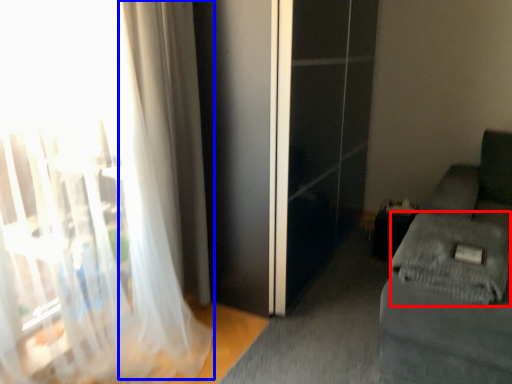
Question: Which of the following is the farthest to the observer, sheet (highlighted by a red box) or curtain (highlighted by a blue box)?

Choices:
 (A) sheet
 (B) curtain

Answer: (B)